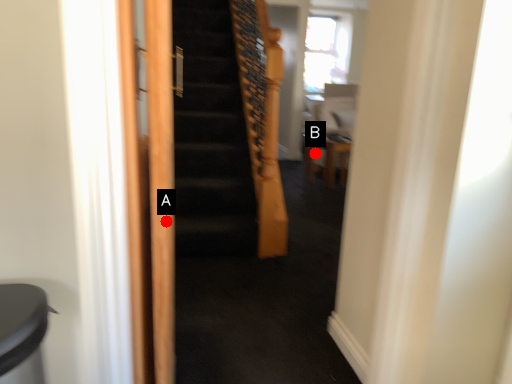
Question: Two points are circled on the image, labeled by A and B beside each circle. Which point is further to the camera?

Choices:
 (A) A is further
 (B) B is further

Answer: (B)